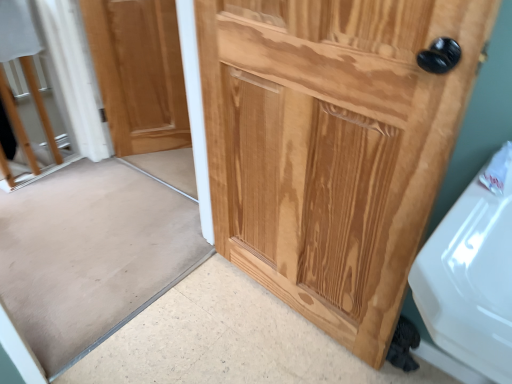
Where is `vacant area situated below natural wood door at right, the 1th door from the front (from a real-world perspective)`? Image resolution: width=512 pixels, height=384 pixels. vacant area situated below natural wood door at right, the 1th door from the front (from a real-world perspective) is located at coordinates (287, 311).